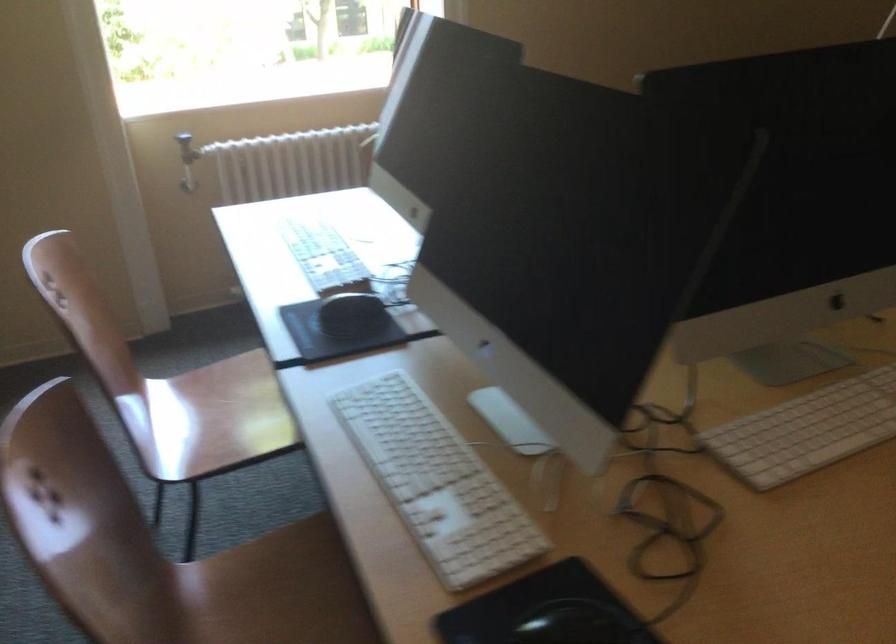
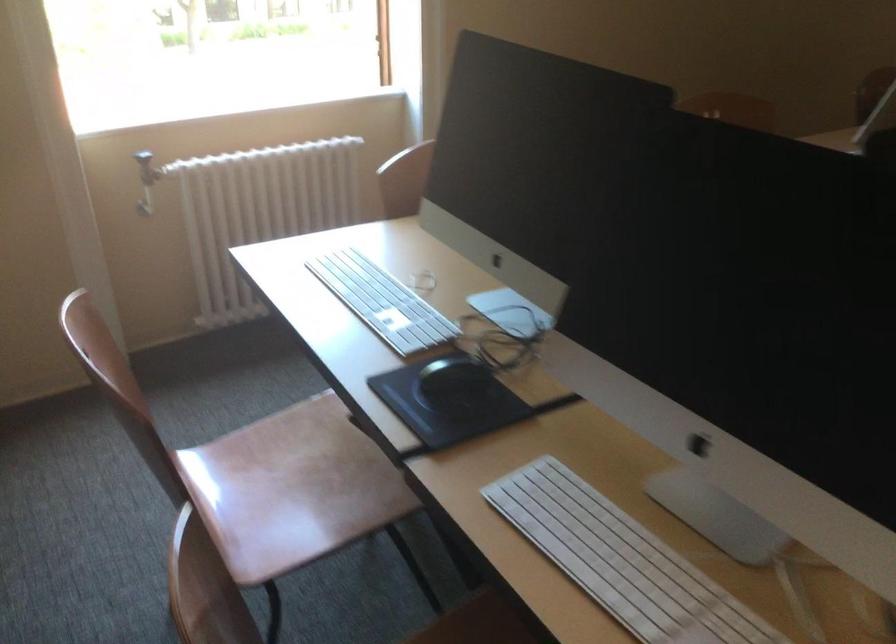
Where in the second image is the point corresponding to the point at 340,305 from the first image?

(452, 377)